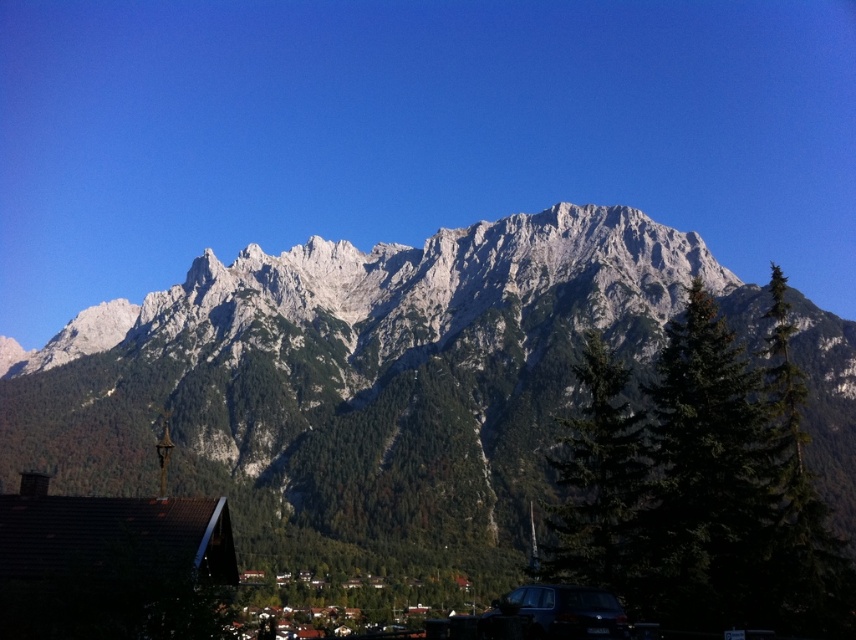
Who is lower down, green textured tree at center or satin black car at lower center?

satin black car at lower center is lower down.

Does green textured tree at center come behind satin black car at lower center?

Yes, green textured tree at center is further from the viewer.

Does point (605, 364) lie behind point (575, 602)?

Yes, it is behind point (575, 602).

Identify the location of green textured tree at center. (599, 483).

Does green coniferous tree at center have a lesser width compared to green textured tree at center?

In fact, green coniferous tree at center might be wider than green textured tree at center.

Is point (718, 336) less distant than point (604, 419)?

That is True.

Identify the location of green coniferous tree at center. (700, 484).

Describe the element at coordinates (700, 484) in the screenshot. I see `green coniferous tree at center` at that location.

Is green coniferous tree at center bigger than satin black car at lower center?

Yes, green coniferous tree at center is bigger than satin black car at lower center.

Describe the element at coordinates (700, 484) in the screenshot. The height and width of the screenshot is (640, 856). I see `green coniferous tree at center` at that location.

Image resolution: width=856 pixels, height=640 pixels. Find the location of `green coniferous tree at center`. green coniferous tree at center is located at coordinates (700, 484).